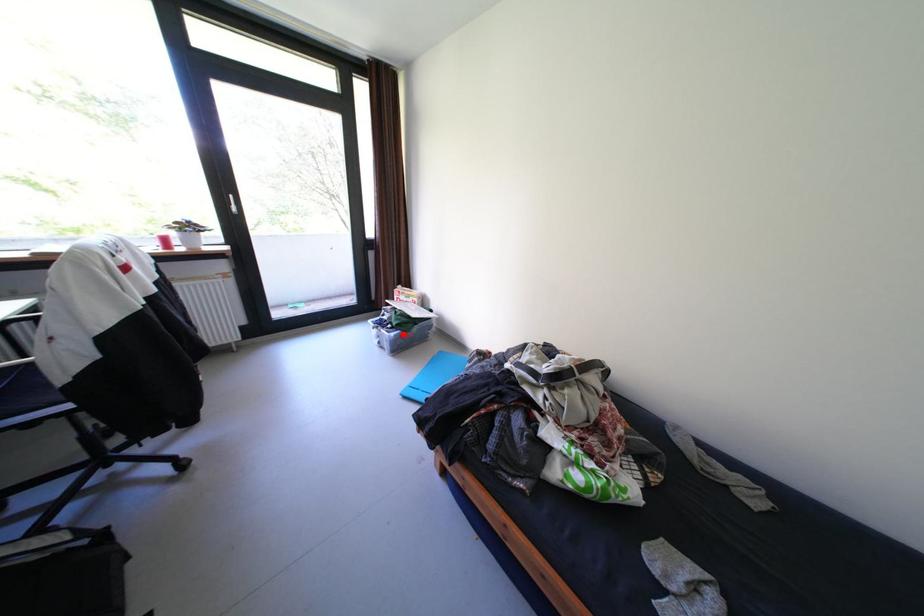
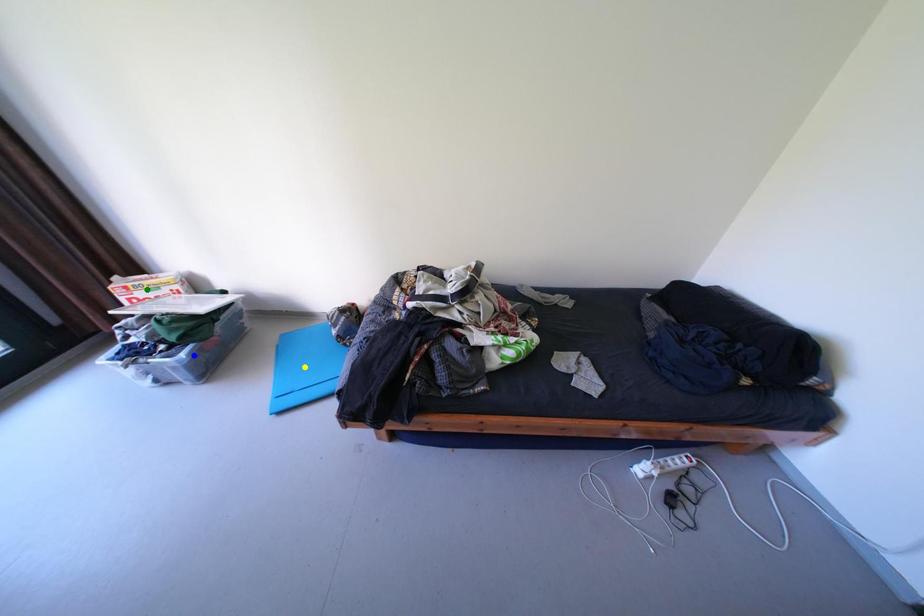
Question: I am providing you with two images of the same scene from different viewpoints. A red point is marked on the first image. You are given multiple points on the second image. Which mark in image 2 goes with the point in image 1?

Choices:
 (A) yellow point
 (B) green point
 (C) blue point

Answer: (C)